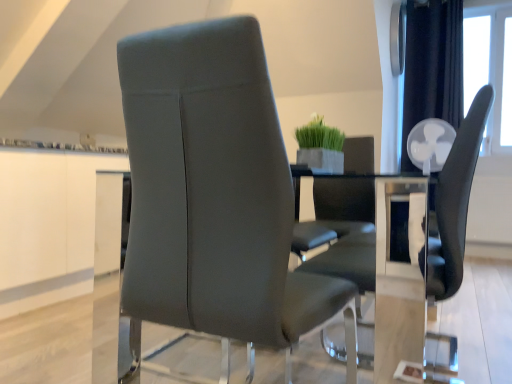
Question: Is matte black chair at center, marked as the 1th chair in a right-to-left arrangement, taller or shorter than green matte plant at center?

Choices:
 (A) tall
 (B) short

Answer: (A)

Question: Is matte black chair at center, placed as the 2th chair when sorted from left to right, in front of or behind green matte plant at center in the image?

Choices:
 (A) front
 (B) behind

Answer: (A)

Question: Which object is positioned farthest from the satin gray leather chair at center, the 2th chair when ordered from right to left?

Choices:
 (A) green matte plant at center
 (B) clear glass table at center
 (C) transparent glass window at upper right
 (D) matte black chair at center, placed as the 2th chair when sorted from left to right

Answer: (C)

Question: Which object is the farthest from the satin gray leather chair at center, the 2th chair when ordered from right to left?

Choices:
 (A) transparent glass window at upper right
 (B) clear glass table at center
 (C) green matte plant at center
 (D) matte black chair at center, placed as the 2th chair when sorted from left to right

Answer: (A)